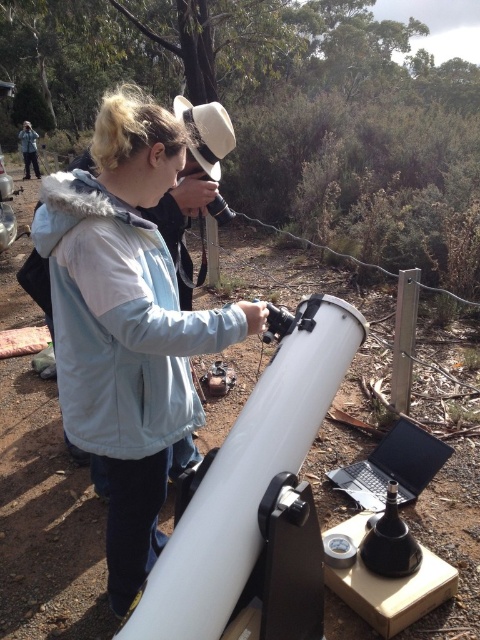
Does matte white telescope at center have a smaller size compared to matte black jacket at upper left?

Indeed, matte white telescope at center has a smaller size compared to matte black jacket at upper left.

Is point (64, 396) closer to viewer compared to point (29, 176)?

Yes, point (64, 396) is in front of point (29, 176).

Between point (109, 275) and point (26, 173), which one is positioned in front?

Point (109, 275)

Where is `matte white telescope at center`? matte white telescope at center is located at coordinates (127, 323).

Between matte white telescope at center and black plastic laptop at lower right, which one appears on the right side from the viewer's perspective?

black plastic laptop at lower right

What do you see at coordinates (127, 323) in the screenshot? Image resolution: width=480 pixels, height=640 pixels. I see `matte white telescope at center` at bounding box center [127, 323].

You are a GUI agent. You are given a task and a screenshot of the screen. Output one action in this format:
    pyautogui.click(x=<x>, y=<y>)
    Task: Click on the matte white telescope at center
    Image resolution: width=480 pixels, height=640 pixels.
    Given the screenshot: What is the action you would take?
    pyautogui.click(x=127, y=323)

Who is lower down, black plastic laptop at lower right or matte black jacket at upper left?

black plastic laptop at lower right is lower down.

Between black plastic laptop at lower right and matte black jacket at upper left, which one is positioned higher?

Positioned higher is matte black jacket at upper left.

Identify the location of black plastic laptop at lower right. (394, 467).

Find the location of a particular element. The width and height of the screenshot is (480, 640). black plastic laptop at lower right is located at coordinates (394, 467).